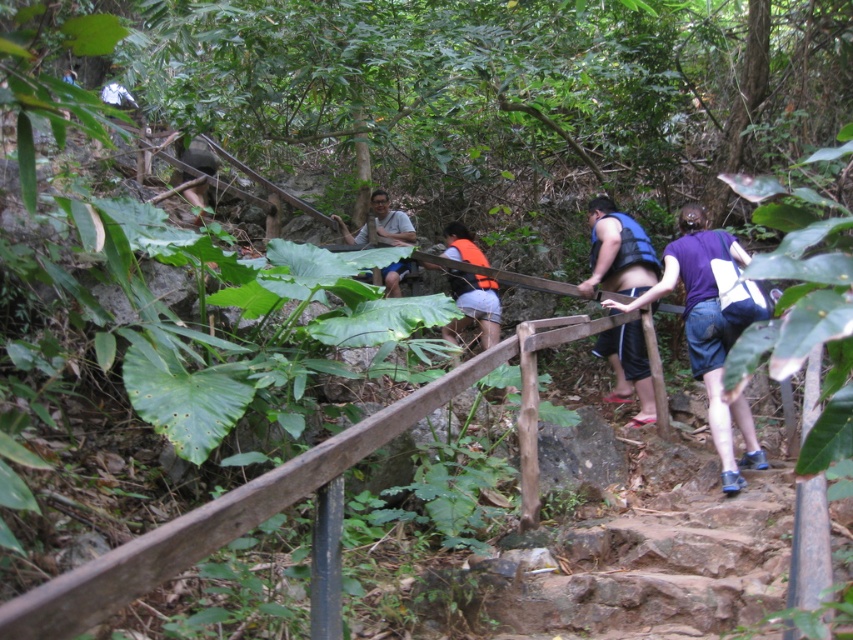
Who is positioned more to the right, brown wooden rail at center or blue fabric shorts at center?

From the viewer's perspective, blue fabric shorts at center appears more on the right side.

From the picture: Is brown wooden rail at center to the left of blue fabric shorts at center from the viewer's perspective?

Indeed, brown wooden rail at center is positioned on the left side of blue fabric shorts at center.

Where is `brown wooden rail at center`? brown wooden rail at center is located at coordinates (283, 492).

Consider the image. Who is taller, brown wooden rail at center or matte gray shirt at center?

brown wooden rail at center

Looking at this image, is brown wooden rail at center shorter than matte gray shirt at center?

No.

Is point (107, 612) closer to camera compared to point (381, 204)?

Yes, point (107, 612) is in front of point (381, 204).

Identify the location of brown wooden rail at center. (283, 492).

Is point (496, 316) closer to camera compared to point (397, 227)?

Yes.

The image size is (853, 640). Describe the element at coordinates (474, 305) in the screenshot. I see `orange life vest at center` at that location.

Is point (488, 336) farther from viewer compared to point (380, 196)?

No, it is not.

This screenshot has height=640, width=853. I want to click on orange life vest at center, so click(474, 305).